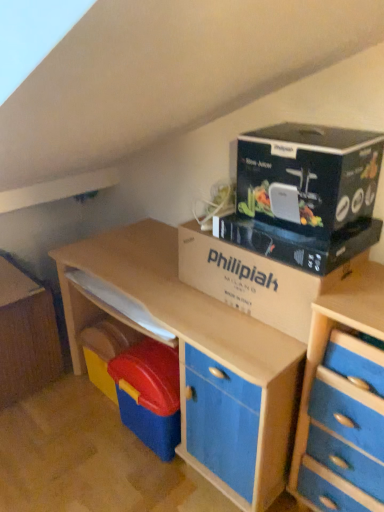
Question: From the image's perspective, is blue matte file cabinet at lower left located beneath black cardboard at upper right?

Choices:
 (A) yes
 (B) no

Answer: (A)

Question: From a real-world perspective, is blue matte file cabinet at lower left beneath black cardboard at upper right?

Choices:
 (A) yes
 (B) no

Answer: (A)

Question: Considering the relative sizes of blue matte file cabinet at lower left and black cardboard at upper right in the image provided, is blue matte file cabinet at lower left taller than black cardboard at upper right?

Choices:
 (A) no
 (B) yes

Answer: (B)

Question: Is blue matte file cabinet at lower left at the right side of black cardboard at upper right?

Choices:
 (A) yes
 (B) no

Answer: (B)

Question: Does blue matte file cabinet at lower left lie behind black cardboard at upper right?

Choices:
 (A) yes
 (B) no

Answer: (A)

Question: Can you confirm if blue matte file cabinet at lower left is shorter than black cardboard at upper right?

Choices:
 (A) no
 (B) yes

Answer: (A)

Question: Does black cardboard at upper right have a greater width compared to blue wood chest of drawers at right?

Choices:
 (A) no
 (B) yes

Answer: (A)

Question: Does black cardboard at upper right have a greater height compared to blue wood chest of drawers at right?

Choices:
 (A) no
 (B) yes

Answer: (A)

Question: Is black cardboard at upper right to the right of blue wood chest of drawers at right from the viewer's perspective?

Choices:
 (A) no
 (B) yes

Answer: (A)

Question: From the image's perspective, is black cardboard at upper right under blue wood chest of drawers at right?

Choices:
 (A) yes
 (B) no

Answer: (B)

Question: Is black cardboard at upper right positioned with its back to blue wood chest of drawers at right?

Choices:
 (A) no
 (B) yes

Answer: (A)

Question: Is the position of black cardboard at upper right more distant than that of blue wood chest of drawers at right?

Choices:
 (A) no
 (B) yes

Answer: (B)

Question: Does black cardboard at upper right have a greater height compared to blue matte file cabinet at lower left?

Choices:
 (A) no
 (B) yes

Answer: (A)